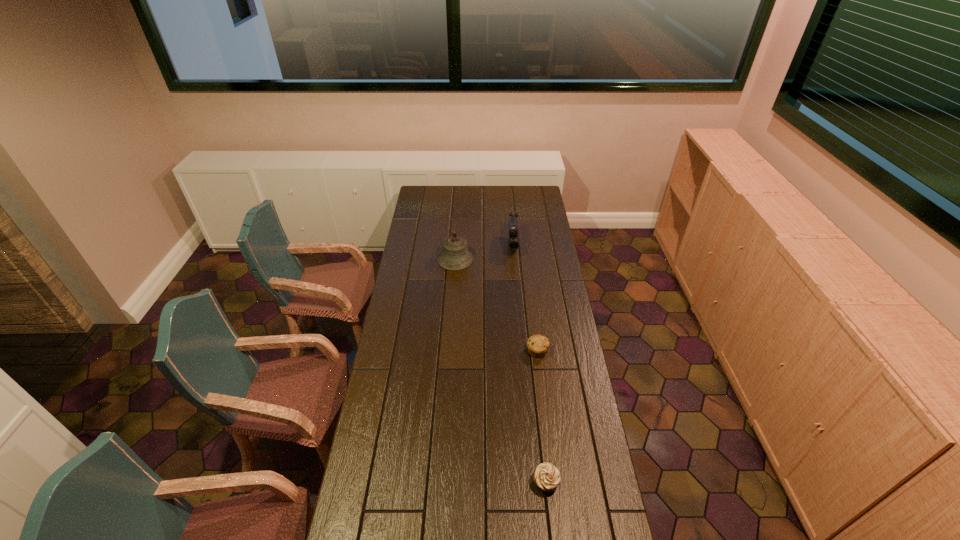
In the image, there is a desktop. At what (x,y) coordinates should I click in order to perform the action: click on vacant space at the far left corner. Please return your answer as a coordinate pair (x, y). The height and width of the screenshot is (540, 960). Looking at the image, I should click on (419, 186).

Image resolution: width=960 pixels, height=540 pixels. In order to click on vacant space that is in between the leftmost object and the nearer muffin in this screenshot , I will do `click(500, 371)`.

I want to click on vacant area that lies between the farther muffin and the nearest object, so click(x=541, y=416).

I want to click on vacant area between the second nearest object and the nearer muffin, so click(x=541, y=416).

This screenshot has width=960, height=540. What are the coordinates of `empty location between the camcorder and the bell` in the screenshot? It's located at (484, 253).

Identify the location of vacant area that lies between the camcorder and the nearest object. (529, 364).

You are a GUI agent. You are given a task and a screenshot of the screen. Output one action in this format:
    pyautogui.click(x=<x>, y=<y>)
    Task: Click on the free point between the camcorder and the farther muffin
    Image resolution: width=960 pixels, height=540 pixels.
    Given the screenshot: What is the action you would take?
    pyautogui.click(x=525, y=299)

Locate an element on the screen. The height and width of the screenshot is (540, 960). vacant point located between the leftmost object and the camcorder is located at coordinates (484, 253).

Locate an element on the screen. This screenshot has height=540, width=960. free space between the nearer muffin and the camcorder is located at coordinates (529, 364).

At what (x,y) coordinates should I click in order to perform the action: click on vacant space in between the bell and the farther muffin. Please return your answer as a coordinate pair (x, y). Looking at the image, I should click on (496, 305).